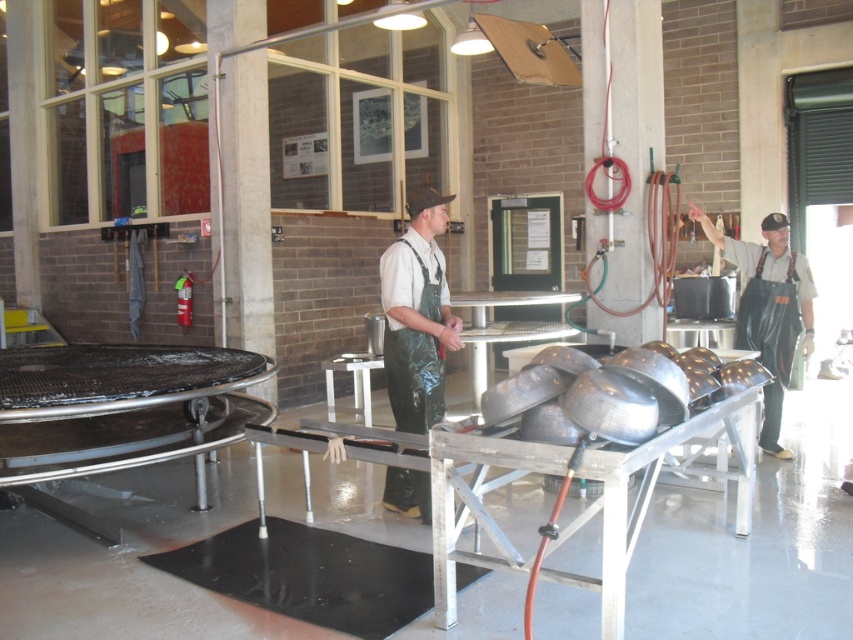
Question: Can you confirm if green rubber apron at center is wider than black rubber apron at right?

Choices:
 (A) no
 (B) yes

Answer: (A)

Question: Which point is farther to the camera?

Choices:
 (A) (405, 403)
 (B) (776, 392)

Answer: (B)

Question: Does green rubber apron at center lie in front of black rubber apron at right?

Choices:
 (A) yes
 (B) no

Answer: (A)

Question: Which point is closer to the camera?

Choices:
 (A) green rubber apron at center
 (B) black rubber apron at right

Answer: (A)

Question: Which point is farther to the camera?

Choices:
 (A) black rubber apron at right
 (B) green rubber apron at center

Answer: (A)

Question: Does green rubber apron at center have a lesser width compared to black rubber apron at right?

Choices:
 (A) yes
 (B) no

Answer: (A)